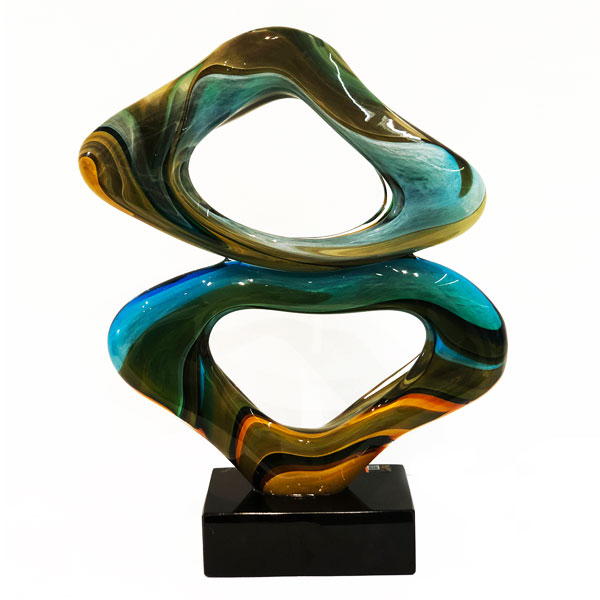
Where is `corners of artwork stand`? corners of artwork stand is located at coordinates click(x=207, y=577), click(x=207, y=518), click(x=411, y=510), click(x=415, y=567), click(x=405, y=469), click(x=219, y=470).